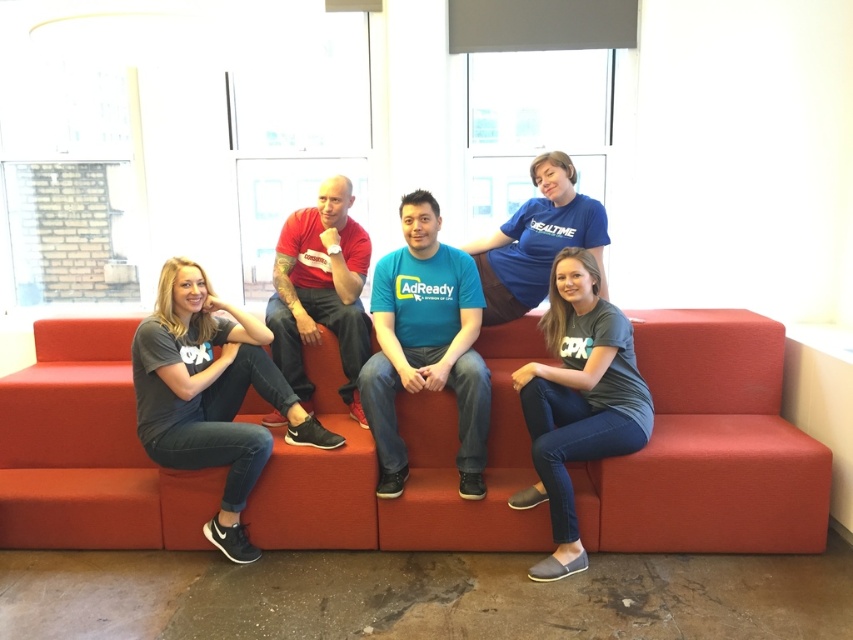
Question: Can you confirm if matte red shirt at center is smaller than blue cotton shirt at center?

Choices:
 (A) yes
 (B) no

Answer: (A)

Question: Estimate the real-world distances between objects in this image. Which object is farther from the gray fabric shirt at left?

Choices:
 (A) blue fabric shirt at center
 (B) fabric couch at center
 (C) blue cotton shirt at center
 (D) matte red shirt at center

Answer: (C)

Question: Which object is positioned farthest from the blue cotton shirt at center?

Choices:
 (A) matte red shirt at center
 (B) gray fabric shirt at left

Answer: (B)

Question: Does fabric couch at center have a lesser width compared to gray cotton shirt at center?

Choices:
 (A) yes
 (B) no

Answer: (B)

Question: Which object is the closest to the matte red shirt at center?

Choices:
 (A) blue fabric shirt at center
 (B) gray cotton shirt at center
 (C) blue cotton shirt at center
 (D) fabric couch at center

Answer: (A)

Question: In this image, where is fabric couch at center located relative to gray fabric shirt at left?

Choices:
 (A) right
 (B) left

Answer: (A)